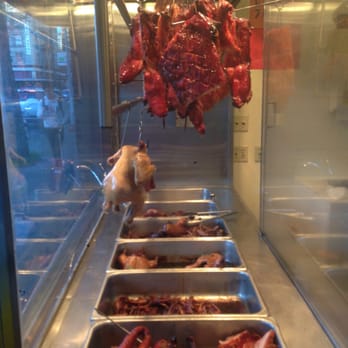
This screenshot has width=348, height=348. Identify the location of rectangular off-white light switch panel. (235, 119).